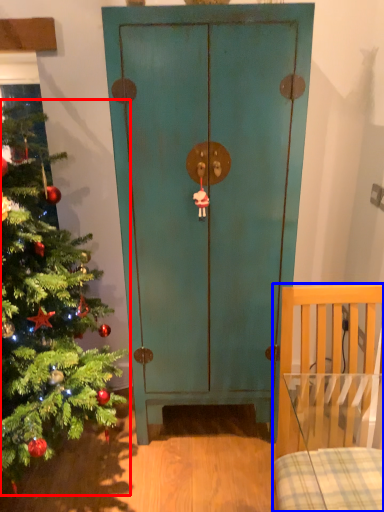
Question: Which object is closer to the camera taking this photo, christmas tree (highlighted by a red box) or furniture (highlighted by a blue box)?

Choices:
 (A) christmas tree
 (B) furniture

Answer: (A)